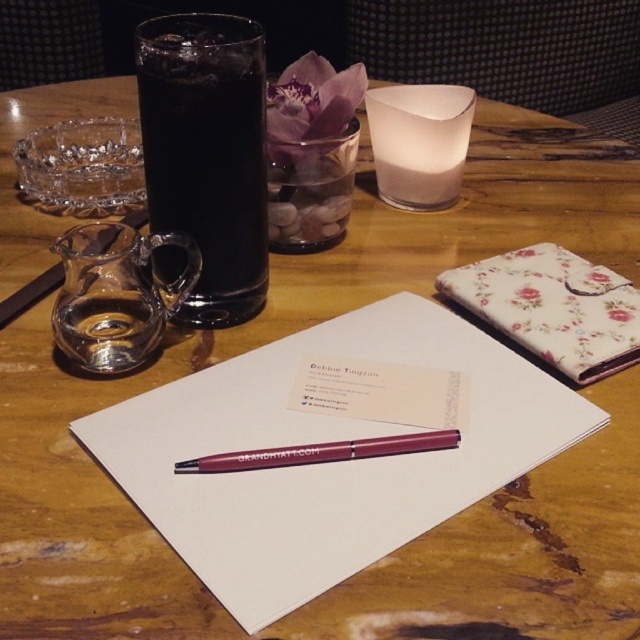
Question: Does black glass at upper left appear on the right side of floral fabric wallet at center?

Choices:
 (A) yes
 (B) no

Answer: (B)

Question: Considering the real-world distances, which object is closest to the black glass at upper left?

Choices:
 (A) white frosted glass candle at center
 (B) matte burgundy pen at center

Answer: (B)

Question: From the image, what is the correct spatial relationship of floral fabric wallet at center in relation to matte burgundy pen at center?

Choices:
 (A) left
 (B) right

Answer: (B)

Question: Is black glass at upper left bigger than matte burgundy pen at center?

Choices:
 (A) yes
 (B) no

Answer: (A)

Question: Which point is closer to the camera?

Choices:
 (A) (232, 248)
 (B) (260, 451)
 (C) (387, 145)
 (D) (621, 317)

Answer: (B)

Question: Which object appears closest to the camera in this image?

Choices:
 (A) matte burgundy pen at center
 (B) white frosted glass candle at center
 (C) black glass at upper left

Answer: (A)